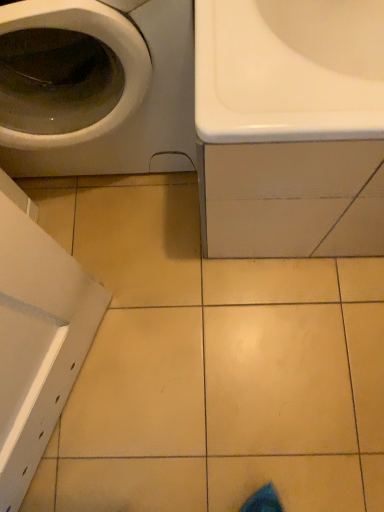
You are a GUI agent. You are given a task and a screenshot of the screen. Output one action in this format:
    pyautogui.click(x=<x>, y=<y>)
    Task: Click on the white glossy sink at upper right
    This screenshot has width=384, height=512.
    Given the screenshot: What is the action you would take?
    pyautogui.click(x=290, y=127)

What is the approximate width of white glossy sink at upper right?

white glossy sink at upper right is 27.29 inches in width.

What do you see at coordinates (290, 127) in the screenshot?
I see `white glossy sink at upper right` at bounding box center [290, 127].

The image size is (384, 512). In order to click on white glossy washing machine at upper left in this screenshot , I will do `click(96, 87)`.

What do you see at coordinates (96, 87) in the screenshot? I see `white glossy washing machine at upper left` at bounding box center [96, 87].

Find the location of a particular element. The image size is (384, 512). white glossy sink at upper right is located at coordinates (290, 127).

Considering the relative positions of white glossy washing machine at upper left and white glossy sink at upper right in the image provided, is white glossy washing machine at upper left to the left or to the right of white glossy sink at upper right?

Clearly, white glossy washing machine at upper left is on the left of white glossy sink at upper right in the image.

From the picture: Considering the positions of objects white glossy washing machine at upper left and white glossy sink at upper right in the image provided, who is behind, white glossy washing machine at upper left or white glossy sink at upper right?

white glossy sink at upper right is behind.

Does point (155, 24) lie behind point (296, 110)?

Yes, it is behind point (296, 110).

From the image's perspective, is white glossy washing machine at upper left on white glossy sink at upper right?

Correct, white glossy washing machine at upper left appears higher than white glossy sink at upper right in the image.

From a real-world perspective, between white glossy washing machine at upper left and white glossy sink at upper right, who is vertically lower?

In real-world perspective, white glossy sink at upper right is lower.

Can you confirm if white glossy washing machine at upper left is wider than white glossy sink at upper right?

Incorrect, the width of white glossy washing machine at upper left does not surpass that of white glossy sink at upper right.

Considering the sizes of objects white glossy washing machine at upper left and white glossy sink at upper right in the image provided, who is taller, white glossy washing machine at upper left or white glossy sink at upper right?

With more height is white glossy washing machine at upper left.

Considering the sizes of objects white glossy washing machine at upper left and white glossy sink at upper right in the image provided, who is bigger, white glossy washing machine at upper left or white glossy sink at upper right?

With larger size is white glossy sink at upper right.

From the picture: Can we say white glossy washing machine at upper left lies outside white glossy sink at upper right?

Yes, white glossy washing machine at upper left is outside of white glossy sink at upper right.

From the picture: Is the surface of white glossy washing machine at upper left in direct contact with white glossy sink at upper right?

There is a gap between white glossy washing machine at upper left and white glossy sink at upper right.

Is white glossy washing machine at upper left positioned with its back to white glossy sink at upper right?

No.

What's the angular difference between white glossy washing machine at upper left and white glossy sink at upper right's facing directions?

The facing directions of white glossy washing machine at upper left and white glossy sink at upper right are 0.000473 degrees apart.

Identify the location of sink behind the white glossy washing machine at upper left. (290, 127).

Considering the positions of objects white glossy sink at upper right and white glossy washing machine at upper left in the image provided, who is more to the right, white glossy sink at upper right or white glossy washing machine at upper left?

Positioned to the right is white glossy sink at upper right.

Which object is further away from the camera taking this photo, white glossy sink at upper right or white glossy washing machine at upper left?

white glossy sink at upper right is more distant.

Is point (213, 246) closer or farther from the camera than point (160, 17)?

Point (213, 246).

From the image's perspective, does white glossy sink at upper right appear lower than white glossy washing machine at upper left?

Yes.

From a real-world perspective, is white glossy sink at upper right positioned above or below white glossy washing machine at upper left?

white glossy sink at upper right is situated lower than white glossy washing machine at upper left in the real world.

Is white glossy sink at upper right wider or thinner than white glossy washing machine at upper left?

Clearly, white glossy sink at upper right has more width compared to white glossy washing machine at upper left.

From the picture: Who is taller, white glossy sink at upper right or white glossy washing machine at upper left?

Standing taller between the two is white glossy washing machine at upper left.

Considering the relative sizes of white glossy sink at upper right and white glossy washing machine at upper left in the image provided, is white glossy sink at upper right bigger than white glossy washing machine at upper left?

Correct, white glossy sink at upper right is larger in size than white glossy washing machine at upper left.

Can we say white glossy sink at upper right lies outside white glossy washing machine at upper left?

Yes, white glossy sink at upper right is outside of white glossy washing machine at upper left.

Are white glossy sink at upper right and white glossy washing machine at upper left beside each other?

white glossy sink at upper right and white glossy washing machine at upper left are clearly separated.

Is white glossy washing machine at upper left at the back of white glossy sink at upper right?

No, white glossy washing machine at upper left is not at the back of white glossy sink at upper right.

How different are the orientations of white glossy sink at upper right and white glossy washing machine at upper left in degrees?

0.000473 degrees.

How distant is white glossy sink at upper right from white glossy washing machine at upper left?

The distance of white glossy sink at upper right from white glossy washing machine at upper left is 11.99 inches.

The image size is (384, 512). In order to click on sink that is behind the white glossy washing machine at upper left in this screenshot , I will do `click(290, 127)`.

The width and height of the screenshot is (384, 512). In the image, there is a white glossy washing machine at upper left. In order to click on sink below it (from a real-world perspective) in this screenshot , I will do `click(290, 127)`.

What are the coordinates of `washing machine on the left of white glossy sink at upper right` in the screenshot? It's located at (96, 87).